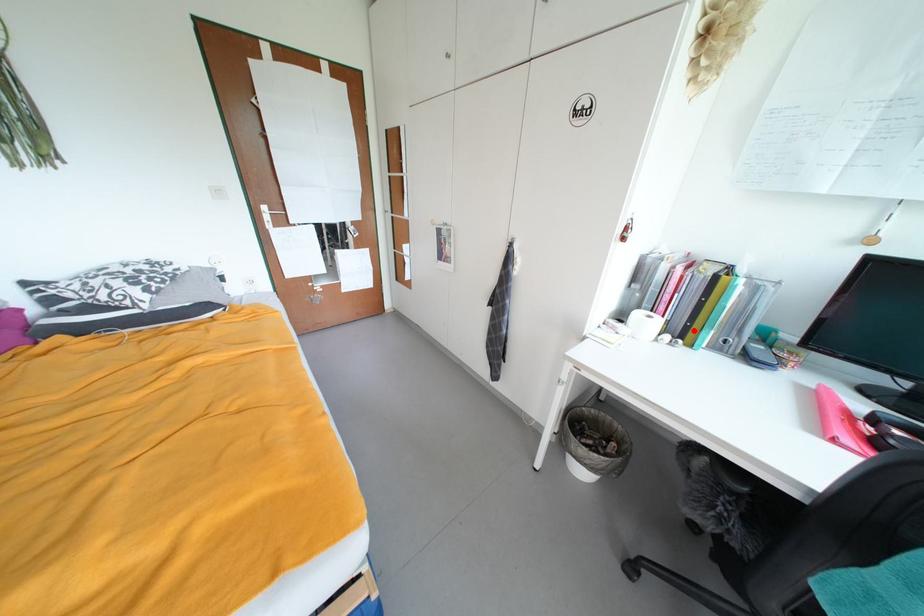
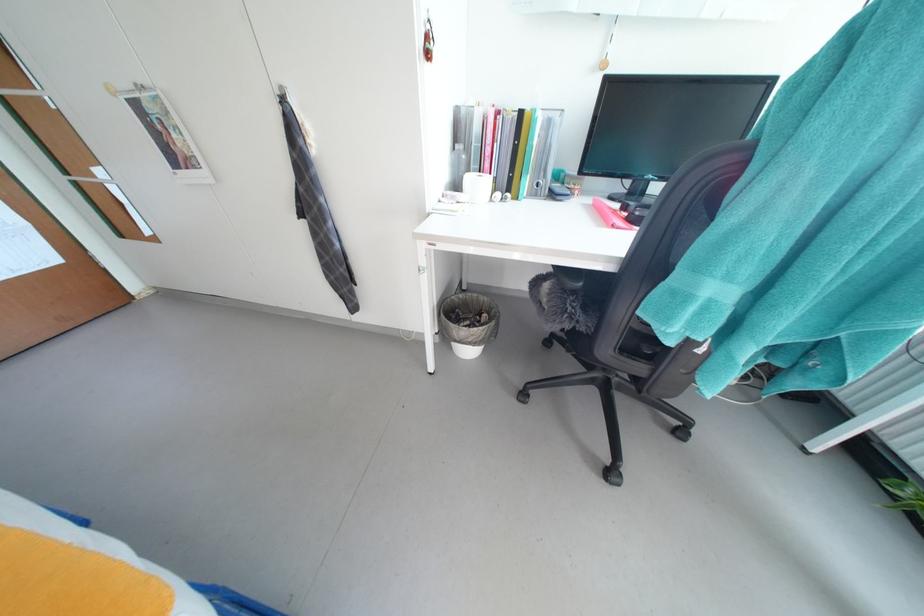
Find the pixel in the second image that matches the highlighted location in the first image.

(517, 183)